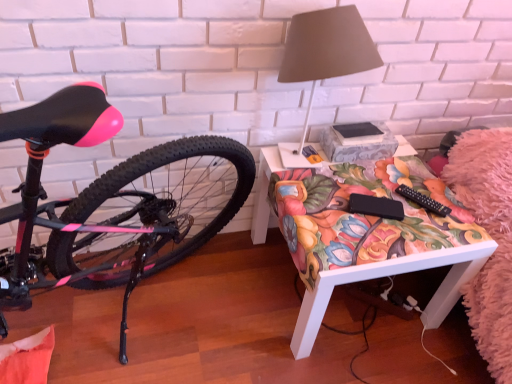
Find the location of a particular element. vacant space to the left of black plastic remote control at lower right is located at coordinates (366, 192).